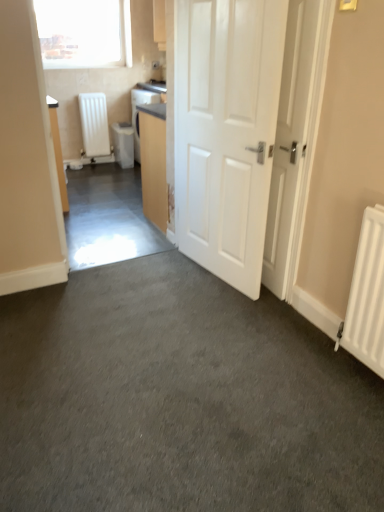
Identify the location of matte wood cabinet at center. The image size is (384, 512). (153, 162).

This screenshot has height=512, width=384. What do you see at coordinates (290, 141) in the screenshot?
I see `white matte door at center, which appears as the 1th door when viewed from the right` at bounding box center [290, 141].

This screenshot has height=512, width=384. Describe the element at coordinates (123, 144) in the screenshot. I see `white plastic water heater at center-left, arranged as the 2th water heater when viewed from the left` at that location.

Locate an element on the screen. The height and width of the screenshot is (512, 384). white glossy door at center, which is counted as the 1th door, starting from the left is located at coordinates (226, 131).

In the scene shown: How much space does white matte radiator at left, which appears as the first water heater when viewed from the left, occupy horizontally?

white matte radiator at left, which appears as the first water heater when viewed from the left, is 6.10 inches in width.

Locate an element on the screen. The height and width of the screenshot is (512, 384). matte wood cabinet at center is located at coordinates (153, 162).

Considering the positions of objects transparent glass window at upper left and white matte door at center, marked as the 2th door in a left-to-right arrangement, in the image provided, who is in front, transparent glass window at upper left or white matte door at center, marked as the 2th door in a left-to-right arrangement,?

white matte door at center, marked as the 2th door in a left-to-right arrangement, is more forward.

Considering the sizes of objects transparent glass window at upper left and white matte door at center, marked as the 2th door in a left-to-right arrangement, in the image provided, who is shorter, transparent glass window at upper left or white matte door at center, marked as the 2th door in a left-to-right arrangement,?

transparent glass window at upper left.

Would you say transparent glass window at upper left is inside or outside white matte door at center, which appears as the 1th door when viewed from the right?

transparent glass window at upper left is located beyond the bounds of white matte door at center, which appears as the 1th door when viewed from the right.

Considering the sizes of transparent glass window at upper left and white matte radiator at left, positioned as the second water heater in right-to-left order, in the image, is transparent glass window at upper left taller or shorter than white matte radiator at left, positioned as the second water heater in right-to-left order,?

Clearly, transparent glass window at upper left is shorter compared to white matte radiator at left, positioned as the second water heater in right-to-left order.

Is transparent glass window at upper left in front of or behind white matte radiator at left, which appears as the first water heater when viewed from the left, in the image?

In the image, transparent glass window at upper left appears in front of white matte radiator at left, which appears as the first water heater when viewed from the left.

Find the location of `the 1st water heater behind the transparent glass window at upper left, starting your count from the anchor`. the 1st water heater behind the transparent glass window at upper left, starting your count from the anchor is located at coordinates (93, 131).

From a real-world perspective, is white matte radiator at left, positioned as the second water heater in right-to-left order, physically above transparent glass window at upper left?

No, from a real-world perspective, white matte radiator at left, positioned as the second water heater in right-to-left order, is not above transparent glass window at upper left.

From the image's perspective, is white matte radiator at left, positioned as the second water heater in right-to-left order, located above transparent glass window at upper left?

No, from the image's perspective, white matte radiator at left, positioned as the second water heater in right-to-left order, is not over transparent glass window at upper left.

The height and width of the screenshot is (512, 384). I want to click on window lying on the left of white matte radiator at left, positioned as the second water heater in right-to-left order, so click(x=84, y=33).

In terms of width, does white matte radiator at left, positioned as the second water heater in right-to-left order, look wider or thinner when compared to transparent glass window at upper left?

In the image, white matte radiator at left, positioned as the second water heater in right-to-left order, appears to be wider than transparent glass window at upper left.

Consider the image. From the image's perspective, would you say white matte door at center, which appears as the 1th door when viewed from the right, is positioned over white plastic water heater at center-left, which is counted as the 1th water heater, starting from the right?

Incorrect, from the image's perspective, white matte door at center, which appears as the 1th door when viewed from the right, is lower than white plastic water heater at center-left, which is counted as the 1th water heater, starting from the right.

Is white matte door at center, which appears as the 1th door when viewed from the right, aimed at white plastic water heater at center-left, which is counted as the 1th water heater, starting from the right?

No, white matte door at center, which appears as the 1th door when viewed from the right, is not oriented towards white plastic water heater at center-left, which is counted as the 1th water heater, starting from the right.

Would you say white matte door at center, which appears as the 1th door when viewed from the right, is inside or outside white plastic water heater at center-left, arranged as the 2th water heater when viewed from the left?

white matte door at center, which appears as the 1th door when viewed from the right, is spatially situated outside white plastic water heater at center-left, arranged as the 2th water heater when viewed from the left.

From the picture: Is white matte door at center, which appears as the 1th door when viewed from the right, wider than white plastic water heater at center-left, which is counted as the 1th water heater, starting from the right?

In fact, white matte door at center, which appears as the 1th door when viewed from the right, might be narrower than white plastic water heater at center-left, which is counted as the 1th water heater, starting from the right.

Would you say white glossy door at center, which is counted as the 1th door, starting from the left, is inside or outside transparent glass window at upper left?

white glossy door at center, which is counted as the 1th door, starting from the left, lies outside transparent glass window at upper left.

Is white glossy door at center, the 2th door when ordered from right to left, aimed at transparent glass window at upper left?

No, white glossy door at center, the 2th door when ordered from right to left, does not turn towards transparent glass window at upper left.

Which of these two, white glossy door at center, the 2th door when ordered from right to left, or transparent glass window at upper left, is bigger?

white glossy door at center, the 2th door when ordered from right to left, is bigger.

Looking at this image, how distant is white matte door at center, marked as the 2th door in a left-to-right arrangement, from white glossy door at center, the 2th door when ordered from right to left?

white matte door at center, marked as the 2th door in a left-to-right arrangement, and white glossy door at center, the 2th door when ordered from right to left, are 11.74 inches apart.

Is white matte door at center, marked as the 2th door in a left-to-right arrangement, thinner than white glossy door at center, the 2th door when ordered from right to left?

Yes, white matte door at center, marked as the 2th door in a left-to-right arrangement, is thinner than white glossy door at center, the 2th door when ordered from right to left.

Does white matte door at center, which appears as the 1th door when viewed from the right, have a greater height compared to white glossy door at center, which is counted as the 1th door, starting from the left?

In fact, white matte door at center, which appears as the 1th door when viewed from the right, may be shorter than white glossy door at center, which is counted as the 1th door, starting from the left.

Is white matte door at center, which appears as the 1th door when viewed from the right, looking in the opposite direction of white glossy door at center, the 2th door when ordered from right to left?

white matte door at center, which appears as the 1th door when viewed from the right, is not turned away from white glossy door at center, the 2th door when ordered from right to left.

Can you confirm if white glossy door at center, the 2th door when ordered from right to left, is wider than white plastic water heater at center-left, arranged as the 2th water heater when viewed from the left?

No, white glossy door at center, the 2th door when ordered from right to left, is not wider than white plastic water heater at center-left, arranged as the 2th water heater when viewed from the left.

Which is more to the left, white glossy door at center, the 2th door when ordered from right to left, or white plastic water heater at center-left, arranged as the 2th water heater when viewed from the left?

white plastic water heater at center-left, arranged as the 2th water heater when viewed from the left.

From the image's perspective, is white glossy door at center, which is counted as the 1th door, starting from the left, located beneath white plastic water heater at center-left, which is counted as the 1th water heater, starting from the right?

Indeed, from the image's perspective, white glossy door at center, which is counted as the 1th door, starting from the left, is shown beneath white plastic water heater at center-left, which is counted as the 1th water heater, starting from the right.

From a real-world perspective, between white glossy door at center, the 2th door when ordered from right to left, and white plastic water heater at center-left, arranged as the 2th water heater when viewed from the left, who is vertically lower?

white plastic water heater at center-left, arranged as the 2th water heater when viewed from the left, from a real-world perspective.

Where is `window on the left of the white matte door at center, which appears as the 1th door when viewed from the right`? The width and height of the screenshot is (384, 512). window on the left of the white matte door at center, which appears as the 1th door when viewed from the right is located at coordinates (84, 33).

From the transparent glass window at upper left, count 1st water heaters backward and point to it. Please provide its 2D coordinates.

[(93, 131)]

From the picture: Based on their spatial positions, is matte wood cabinet at center or white plastic water heater at center-left, arranged as the 2th water heater when viewed from the left, closer to transparent glass window at upper left?

white plastic water heater at center-left, arranged as the 2th water heater when viewed from the left, is positioned closer to the anchor transparent glass window at upper left.

Looking at the image, which one is located closer to white glossy door at center, which is counted as the 1th door, starting from the left, white matte radiator at left, positioned as the second water heater in right-to-left order, or matte wood cabinet at center?

Based on the image, matte wood cabinet at center appears to be nearer to white glossy door at center, which is counted as the 1th door, starting from the left.

Consider the image. From the image, which object appears to be nearer to white matte radiator at left, positioned as the second water heater in right-to-left order, white matte door at center, which appears as the 1th door when viewed from the right, or white glossy door at center, the 2th door when ordered from right to left?

Among the two, white glossy door at center, the 2th door when ordered from right to left, is located nearer to white matte radiator at left, positioned as the second water heater in right-to-left order.

From the image, which object appears to be nearer to matte wood cabinet at center, white matte radiator at left, which appears as the first water heater when viewed from the left, or white glossy door at center, which is counted as the 1th door, starting from the left?

white glossy door at center, which is counted as the 1th door, starting from the left, lies closer to matte wood cabinet at center than the other object.

Looking at the image, which one is located further to matte wood cabinet at center, white matte door at center, which appears as the 1th door when viewed from the right, or white plastic water heater at center-left, which is counted as the 1th water heater, starting from the right?

Based on the image, white plastic water heater at center-left, which is counted as the 1th water heater, starting from the right, appears to be further to matte wood cabinet at center.

Based on their spatial positions, is white plastic water heater at center-left, which is counted as the 1th water heater, starting from the right, or white matte radiator at left, positioned as the second water heater in right-to-left order, closer to white matte door at center, marked as the 2th door in a left-to-right arrangement?

Among the two, white plastic water heater at center-left, which is counted as the 1th water heater, starting from the right, is located nearer to white matte door at center, marked as the 2th door in a left-to-right arrangement.

In the scene shown: When comparing their distances from white matte door at center, which appears as the 1th door when viewed from the right, does transparent glass window at upper left or white matte radiator at left, which appears as the first water heater when viewed from the left, seem further?

The object further to white matte door at center, which appears as the 1th door when viewed from the right, is transparent glass window at upper left.

Considering their positions, is white glossy door at center, which is counted as the 1th door, starting from the left, positioned closer to white matte door at center, which appears as the 1th door when viewed from the right, than matte wood cabinet at center?

Among the two, white glossy door at center, which is counted as the 1th door, starting from the left, is located nearer to white matte door at center, which appears as the 1th door when viewed from the right.

The height and width of the screenshot is (512, 384). In order to click on window located between white glossy door at center, the 2th door when ordered from right to left, and white matte radiator at left, positioned as the second water heater in right-to-left order, in the depth direction in this screenshot , I will do `click(84, 33)`.

Find the location of a particular element. The height and width of the screenshot is (512, 384). cabinetry between white matte door at center, which appears as the 1th door when viewed from the right, and transparent glass window at upper left, along the z-axis is located at coordinates tap(153, 162).

Locate an element on the screen. water heater between transparent glass window at upper left and white plastic water heater at center-left, arranged as the 2th water heater when viewed from the left, vertically is located at coordinates (93, 131).

The image size is (384, 512). I want to click on window located between matte wood cabinet at center and white plastic water heater at center-left, which is counted as the 1th water heater, starting from the right, in the depth direction, so click(84, 33).